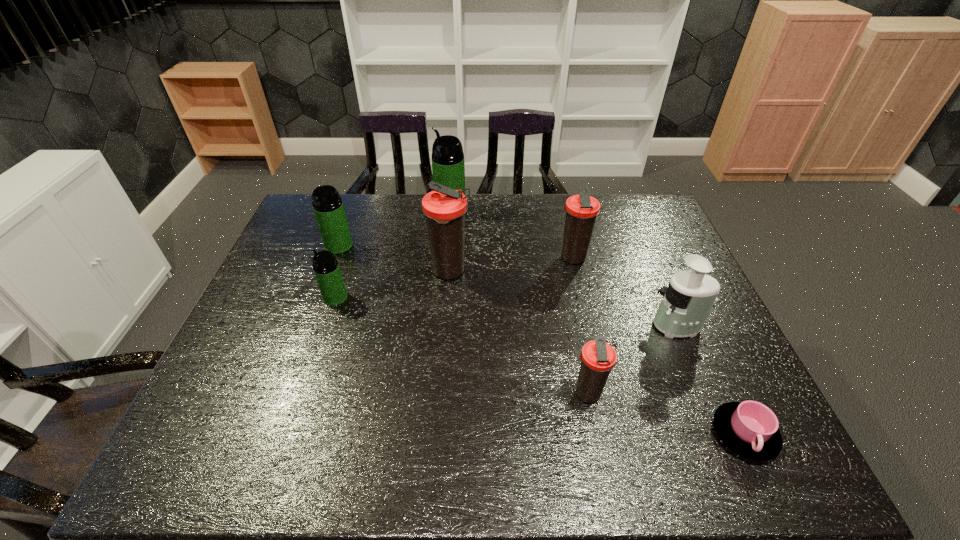
Image resolution: width=960 pixels, height=540 pixels. Identify the location of vacant region between the juicer and the biggest green thermos bottle. (564, 267).

In order to click on free point between the shortest object and the farthest thermos bottle in this screenshot , I will do `click(597, 321)`.

Find the location of a particular element. free space between the biggest brown thermos bottle and the second biggest green thermos bottle is located at coordinates click(x=395, y=259).

Image resolution: width=960 pixels, height=540 pixels. Identify the location of blank region between the shortest object and the juicer. (711, 380).

This screenshot has width=960, height=540. Identify the location of the sixth closest object relative to the second biggest brown thermos bottle. (326, 268).

Select which object is the fifth closest to the smallest green thermos bottle. Please provide its 2D coordinates. Your answer should be formatted as a tuple, i.e. [(x, y)], where the tuple contains the x and y coordinates of a point satisfying the conditions above.

[(597, 357)]

Select which thermos bottle is the closest to the smallest green thermos bottle. Please provide its 2D coordinates. Your answer should be formatted as a tuple, i.e. [(x, y)], where the tuple contains the x and y coordinates of a point satisfying the conditions above.

[(328, 207)]

Where is `thermos bottle that stands as the fourth closest to the nearest thermos bottle`? thermos bottle that stands as the fourth closest to the nearest thermos bottle is located at coordinates (448, 168).

Locate which brown thermos bottle ranks second in proximity to the second smallest green thermos bottle. Please provide its 2D coordinates. Your answer should be formatted as a tuple, i.e. [(x, y)], where the tuple contains the x and y coordinates of a point satisfying the conditions above.

[(581, 210)]

Locate which brown thermos bottle ranks second in proximity to the smallest brown thermos bottle. Please provide its 2D coordinates. Your answer should be formatted as a tuple, i.e. [(x, y)], where the tuple contains the x and y coordinates of a point satisfying the conditions above.

[(581, 210)]